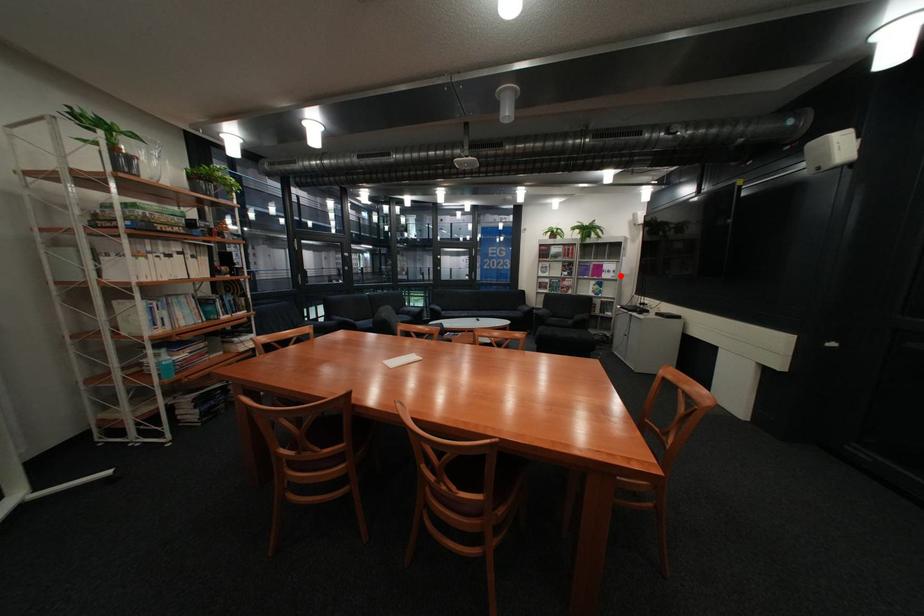
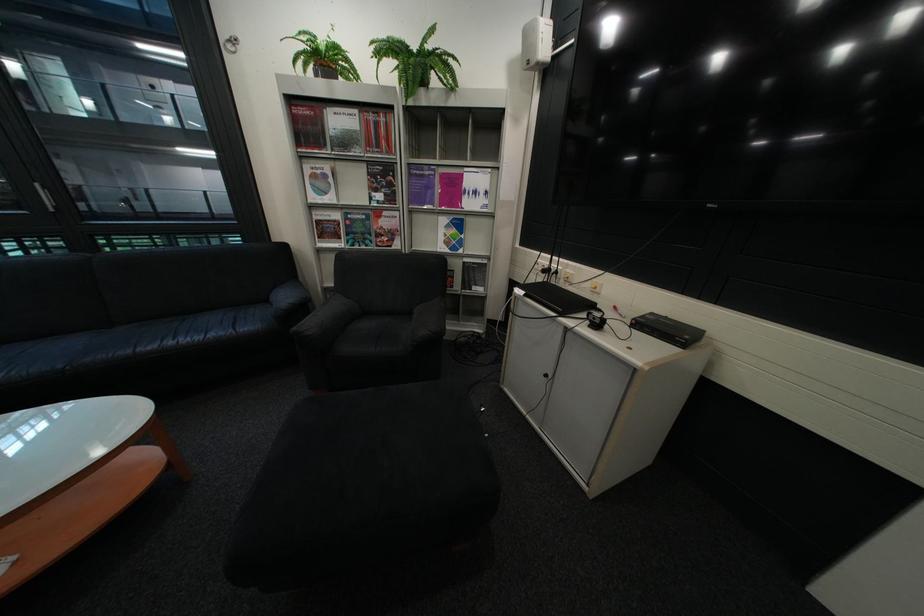
The point at the highlighted location is marked in the first image. Where is the corresponding point in the second image?

(484, 204)